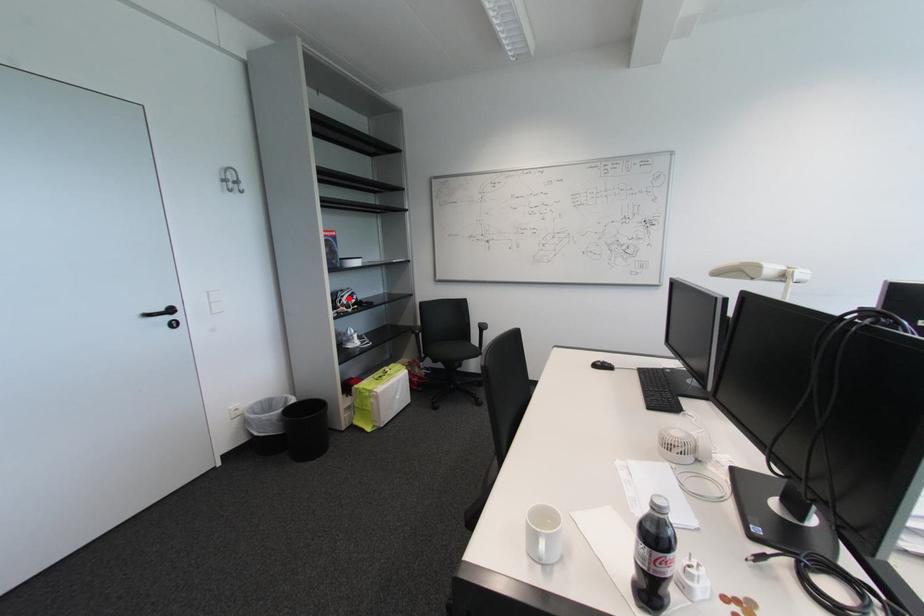
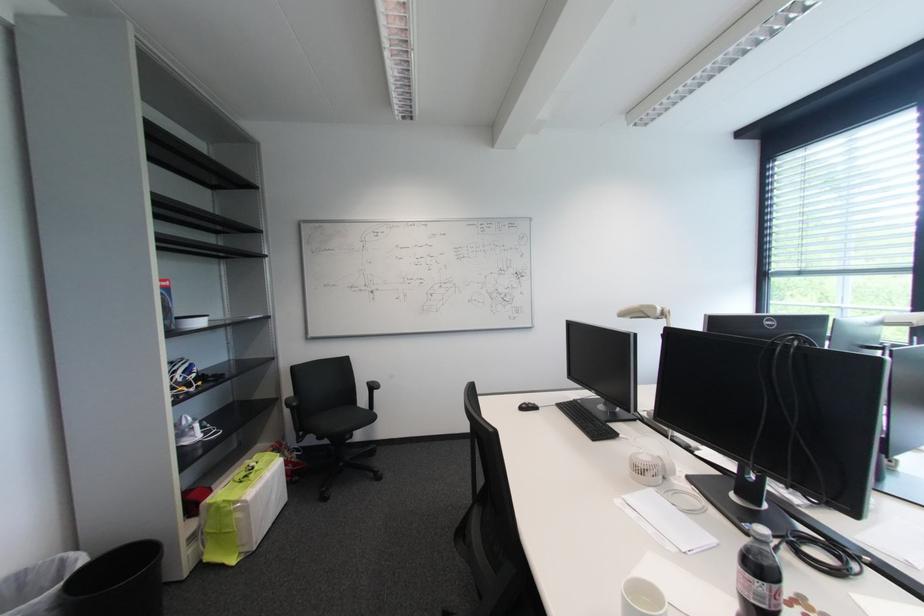
Find the pixel in the second image that matches the highlighted location in the first image.

(181, 373)